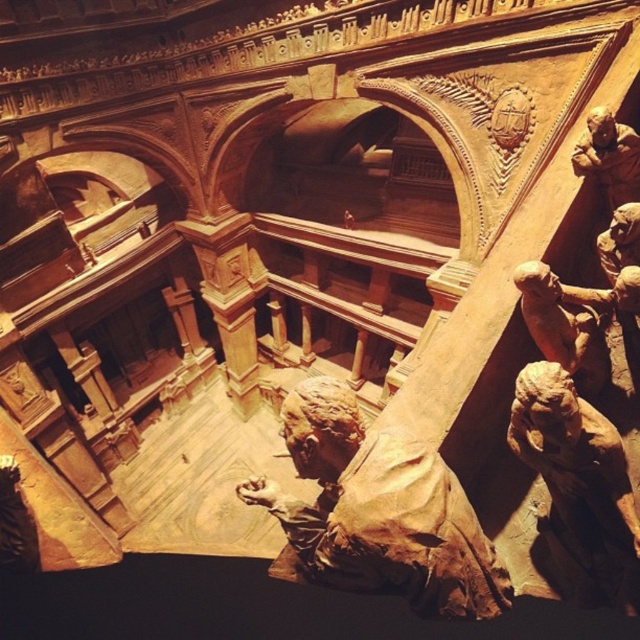
Does brown clay figure at center have a greater height compared to brown clay figure at upper right?

Yes.

Is brown clay figure at center behind brown clay figure at upper right?

No, brown clay figure at center is closer to the viewer.

Identify the location of brown clay figure at center. (378, 513).

The height and width of the screenshot is (640, 640). I want to click on brown clay figure at center, so 378,513.

Between point (374, 461) and point (634, 589), which one is positioned in front?

Point (634, 589)

Who is more distant from viewer, [384,464] or [536,384]?

The point [384,464] is more distant.

I want to click on brown clay figure at center, so click(x=378, y=513).

Is the position of matte brown statue at lower right more distant than that of brown clay figure at upper right?

That is False.

Can you confirm if matte brown statue at lower right is positioned to the left of brown clay figure at upper right?

Indeed, matte brown statue at lower right is positioned on the left side of brown clay figure at upper right.

Is point (611, 525) farther from camera compared to point (630, 166)?

No, it is not.

Locate an element on the screen. matte brown statue at lower right is located at coordinates (579, 484).